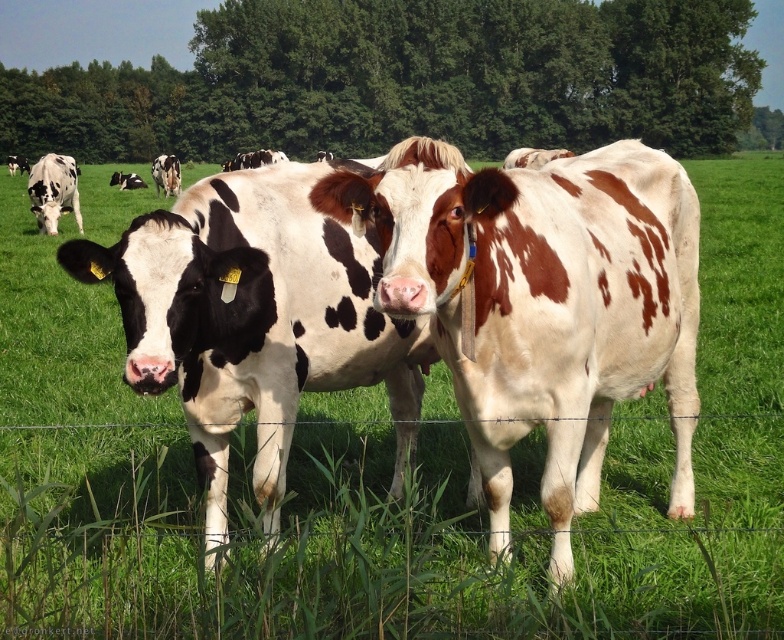
Question: Is brown spotted cow at center further to the viewer compared to black and white spotted cow at upper left?

Choices:
 (A) yes
 (B) no

Answer: (B)

Question: Estimate the real-world distances between objects in this image. Which object is closer to the black and white spotted cow at upper left?

Choices:
 (A) black and white spotted cow at left
 (B) brown spotted cow at center

Answer: (A)

Question: Which object is farther from the camera taking this photo?

Choices:
 (A) brown spotted cow at center
 (B) black and white spotted cow at upper left
 (C) black and white spotted cow at left

Answer: (B)

Question: Does black and white spotted cow at left lie in front of black and white spotted cow at upper left?

Choices:
 (A) no
 (B) yes

Answer: (B)

Question: Is brown spotted cow at center closer to the viewer compared to black and white spotted cow at left?

Choices:
 (A) yes
 (B) no

Answer: (A)

Question: Which point is farther to the camera?

Choices:
 (A) black and white spotted cow at upper left
 (B) brown spotted cow at center

Answer: (A)